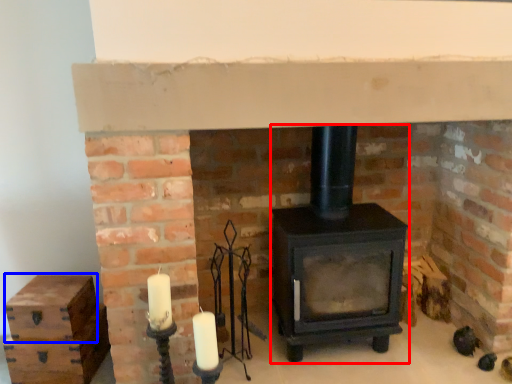
Question: Which point is closer to the camera, wood burning stove (highlighted by a red box) or drawer (highlighted by a blue box)?

Choices:
 (A) wood burning stove
 (B) drawer

Answer: (A)